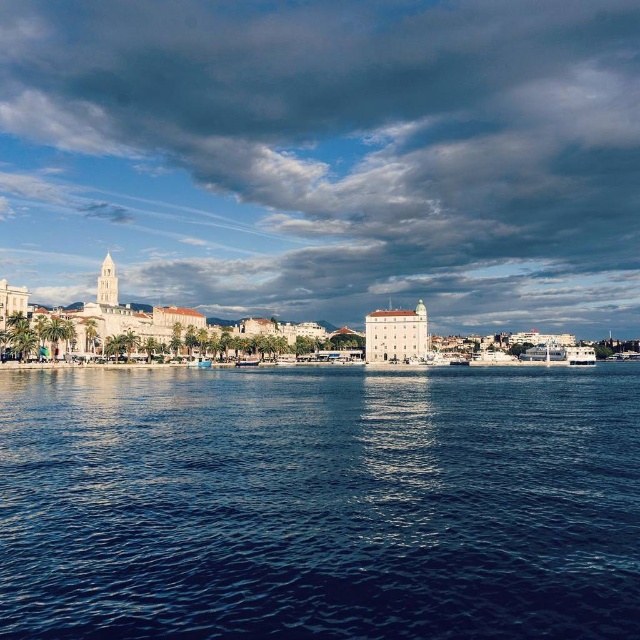
You are navigating a small boat in the coastal scene and need to reach the white building with a green dome. According to the coordinates provided, where is the blue liquid water at center situated relative to your boat?

The blue liquid water at center is located at point (321,502), so if your boat is in the water, it is positioned at that coordinate.

You are a photographer planning to capture the entire scene in one shot. Given that the white glossy boat at lower left is smaller than the blue liquid water at center, which object should you focus on to ensure both are visible without cropping?

You should focus on the blue liquid water at center since it is larger in size than the white glossy boat at lower left, ensuring both can fit within the frame.

You are standing on the promenade and want to take a photo of the white glossy boat at lower left without the cloudy sky at upper center in the frame. Which direction should you move to achieve this?

Move to the right so that the cloudy sky at upper center is no longer above the white glossy boat at lower left in your view.